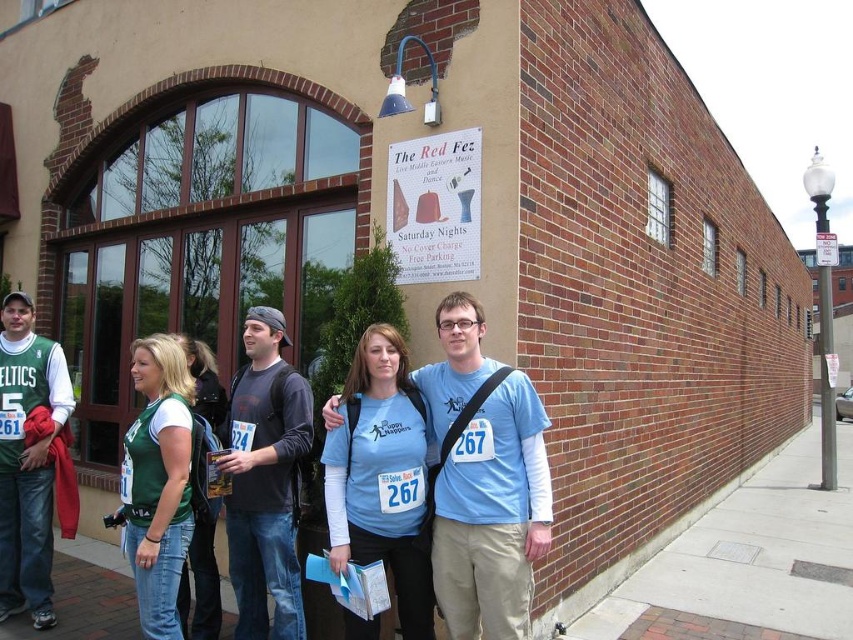
Question: Is brick pavement at lower right smaller than green fabric shirt at center?

Choices:
 (A) yes
 (B) no

Answer: (B)

Question: Can you confirm if brick pavement at lower right is smaller than green fabric shirt at center?

Choices:
 (A) yes
 (B) no

Answer: (B)

Question: Based on their relative distances, which object is farther from the brick pavement at lower right?

Choices:
 (A) blue fabric shirt at center
 (B) green fabric shirt at center

Answer: (B)

Question: Which point is closer to the camera taking this photo?

Choices:
 (A) (364, 449)
 (B) (766, 512)

Answer: (A)

Question: Does brick pavement at lower right have a greater width compared to blue fabric shirt at center?

Choices:
 (A) no
 (B) yes

Answer: (B)

Question: Which of the following is the closest to the observer?

Choices:
 (A) (341, 547)
 (B) (161, 385)

Answer: (A)